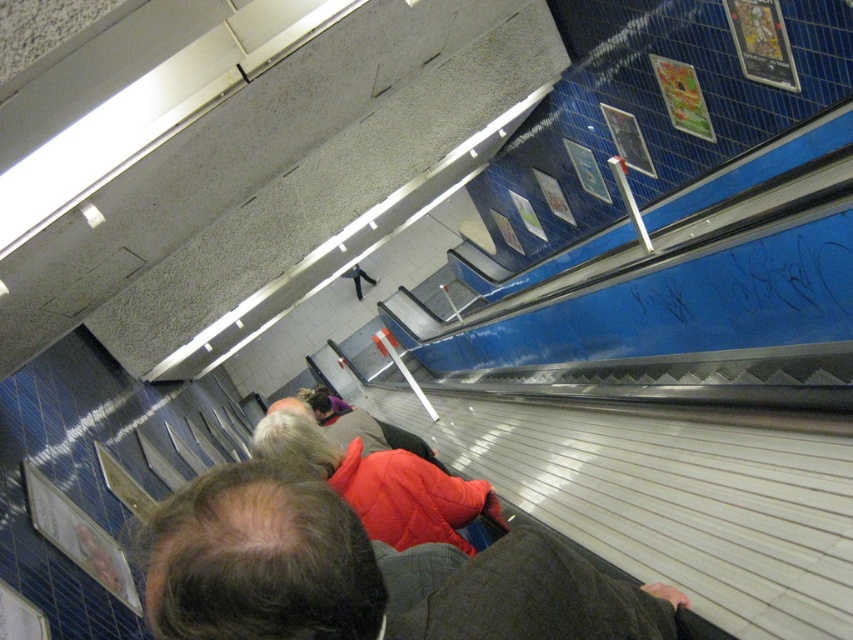
Can you confirm if red quilted jacket at center is wider than red puffy coat at center?

In fact, red quilted jacket at center might be narrower than red puffy coat at center.

Where is `red quilted jacket at center`? Image resolution: width=853 pixels, height=640 pixels. red quilted jacket at center is located at coordinates (363, 573).